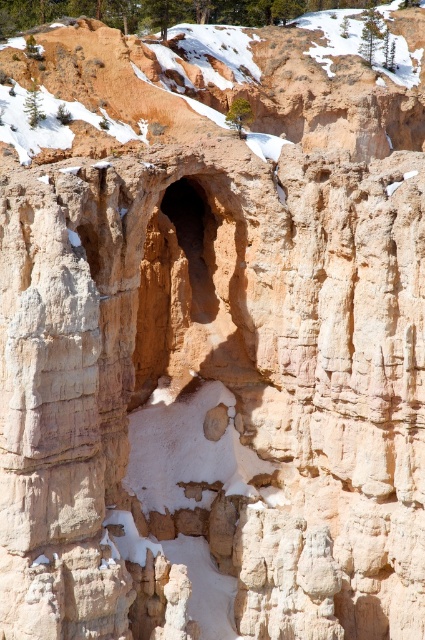
You are a geologist examining the image of the rugged rock formations. You notice the smooth sandstone canyon at center and the rustic sandstone cave at center. Which of these two features is positioned to the right side of the other?

The smooth sandstone canyon at center is to the right of rustic sandstone cave at center.

You are a geologist planning to traverse from the smooth sandstone canyon at center to the rustic sandstone cave at center. Given that your equipment can only handle paths up to 15 meters in length, will you be able to safely make the journey?

The distance between the smooth sandstone canyon at center and the rustic sandstone cave at center is 15.78 meters, which exceeds the equipment limit of 15 meters. Therefore, the journey may not be safe with the current equipment capacity.